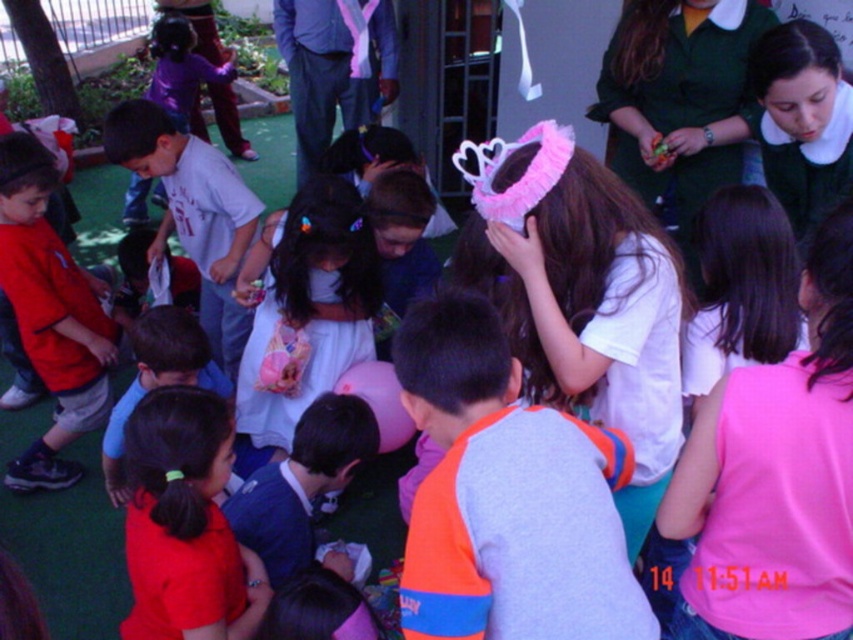
Can you confirm if orange fabric shirt at center is wider than pink fluffy crown at center?

Incorrect, orange fabric shirt at center's width does not surpass pink fluffy crown at center's.

Between point (556, 460) and point (566, 396), which one is positioned in front?

Point (556, 460)

Locate an element on the screen. This screenshot has height=640, width=853. orange fabric shirt at center is located at coordinates (508, 497).

From the picture: Does white satin dress at center appear on the right side of matte red shirt at left?

Yes, white satin dress at center is to the right of matte red shirt at left.

Which is in front, point (258, 269) or point (45, 356)?

Positioned in front is point (45, 356).

Find the location of `white satin dress at center`. white satin dress at center is located at coordinates (305, 307).

Does orange fabric shirt at center appear on the right side of white satin dress at center?

Indeed, orange fabric shirt at center is positioned on the right side of white satin dress at center.

Is point (548, 508) farther from viewer compared to point (306, 400)?

No, (548, 508) is in front of (306, 400).

The height and width of the screenshot is (640, 853). What do you see at coordinates (508, 497) in the screenshot? I see `orange fabric shirt at center` at bounding box center [508, 497].

Locate an element on the screen. orange fabric shirt at center is located at coordinates (508, 497).